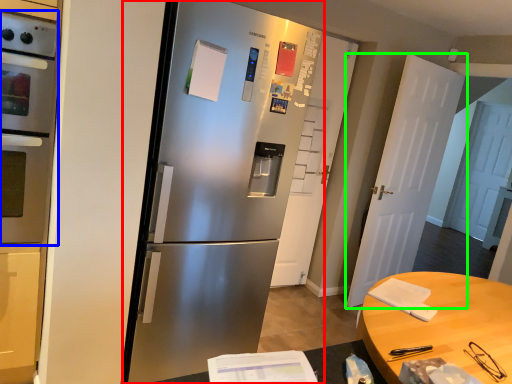
Question: Based on their relative distances, which object is farther from refrigerator (highlighted by a red box)? Choose from oven (highlighted by a blue box) and door (highlighted by a green box).

Choices:
 (A) oven
 (B) door

Answer: (B)